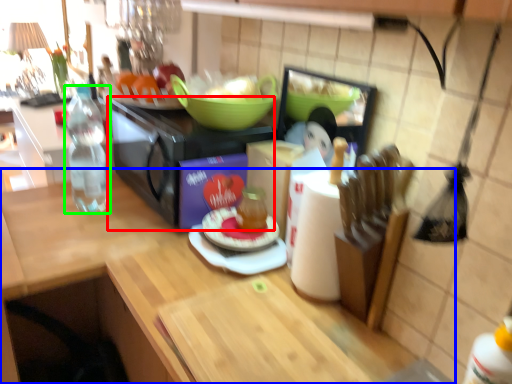
Question: Based on their relative distances, which object is nearer to appliance (highlighted by a red box)? Choose from countertop (highlighted by a blue box) and bottle (highlighted by a green box).

Choices:
 (A) countertop
 (B) bottle

Answer: (B)